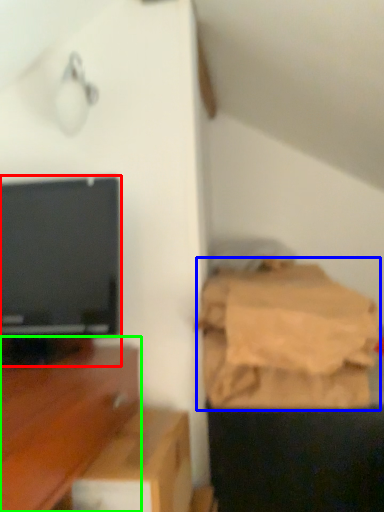
Question: Estimate the real-world distances between objects in this image. Which object is farther from television (highlighted by a red box), sheet (highlighted by a blue box) or furniture (highlighted by a green box)?

Choices:
 (A) sheet
 (B) furniture

Answer: (A)